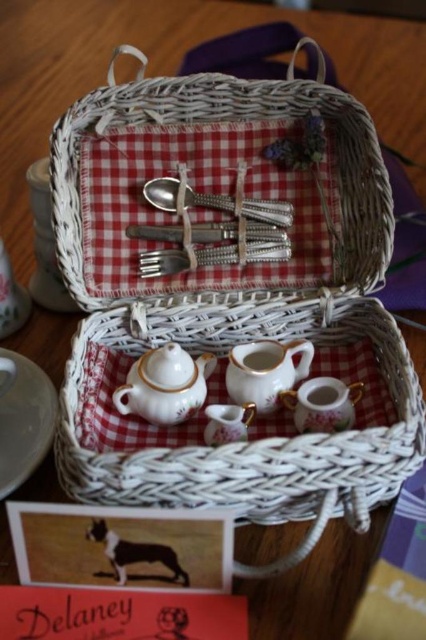
From the picture: You are setting up a picnic and need to access the porcelain teapot at center. Since the white wicker picnic basket at center is in the way, can you lift the basket to reach the teapot?

The white wicker picnic basket at center is located above the porcelain teapot at center, so you can lift the basket to access the teapot underneath.

You are setting up a tea service for a guest. You have a porcelain teapot at center and a matte porcelain teacup at center. Which object should you grab first to pour tea into the teacup?

The porcelain teapot at center is in front of the matte porcelain teacup at center, so you should grab the porcelain teapot at center first to pour tea into the teacup.

You are setting up a picnic and need to access the porcelain teacup at lower center inside the white wicker basket at center. Can you easily reach it without moving the basket?

The white wicker basket at center is in front of the porcelain teacup at lower center, so the basket is blocking access to the teacup. You would need to move the basket to reach it.